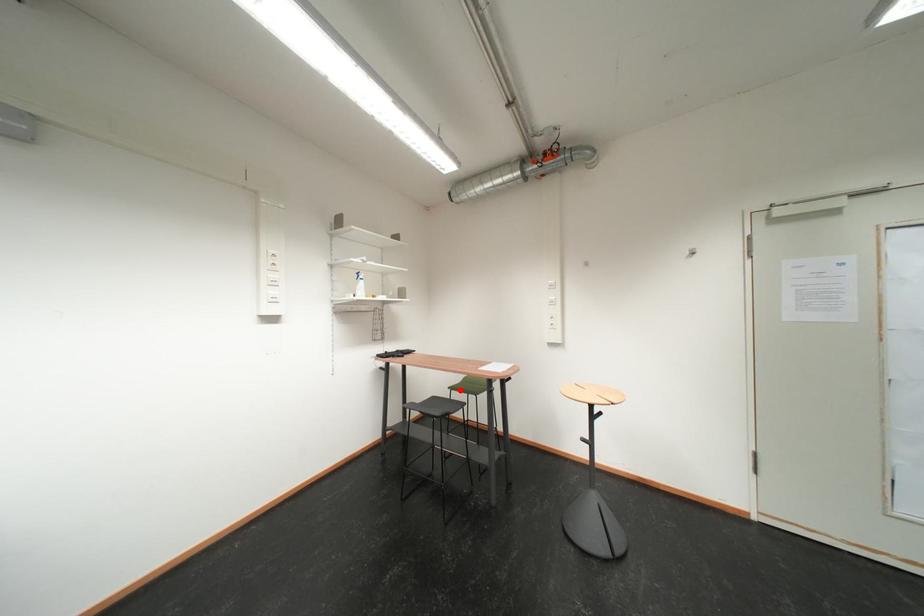
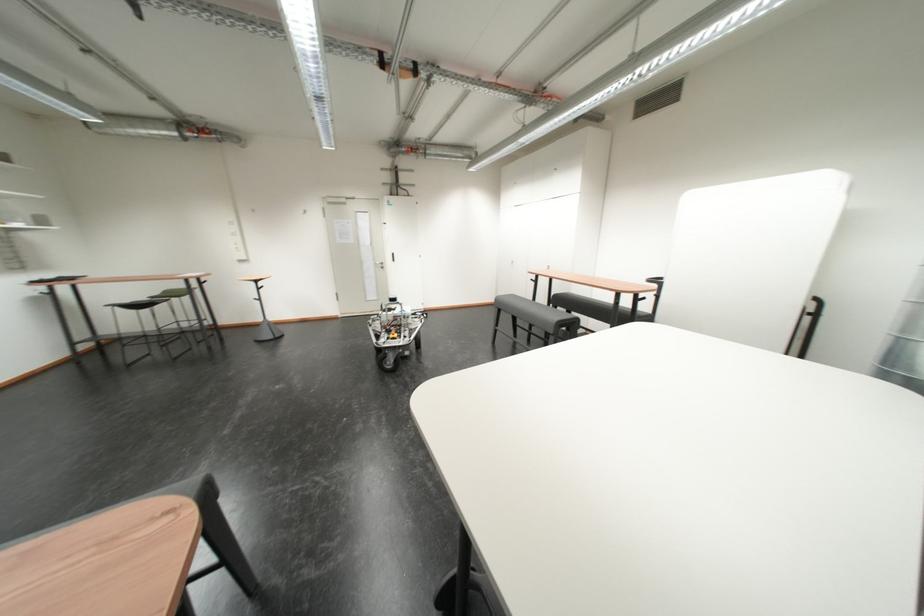
Locate, in the second image, the point that corresponds to the highlighted location in the first image.

(160, 300)